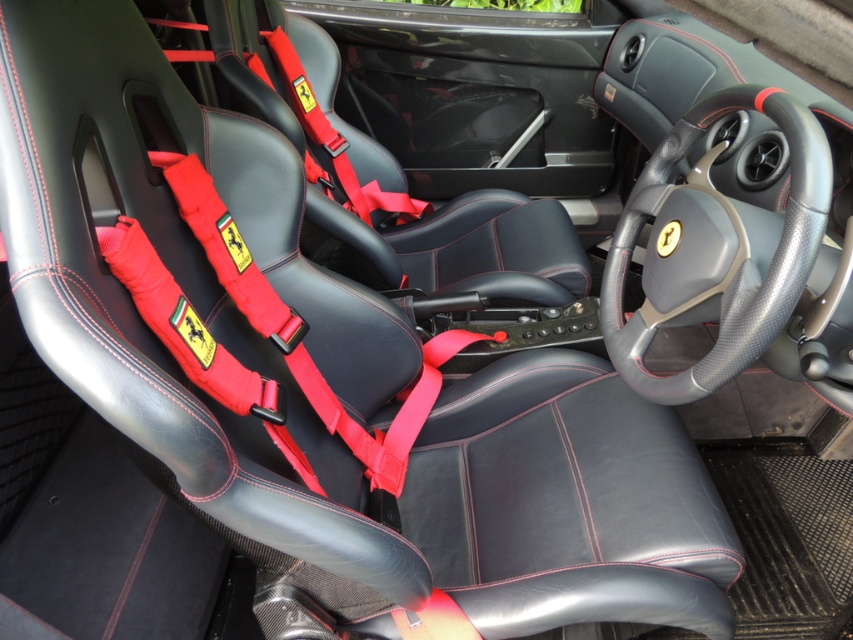
Does carbon fiber steering wheel at center have a larger size compared to black leather seat at center?

No, carbon fiber steering wheel at center is not bigger than black leather seat at center.

The height and width of the screenshot is (640, 853). What do you see at coordinates (715, 250) in the screenshot?
I see `carbon fiber steering wheel at center` at bounding box center [715, 250].

What are the coordinates of `carbon fiber steering wheel at center` in the screenshot? It's located at (715, 250).